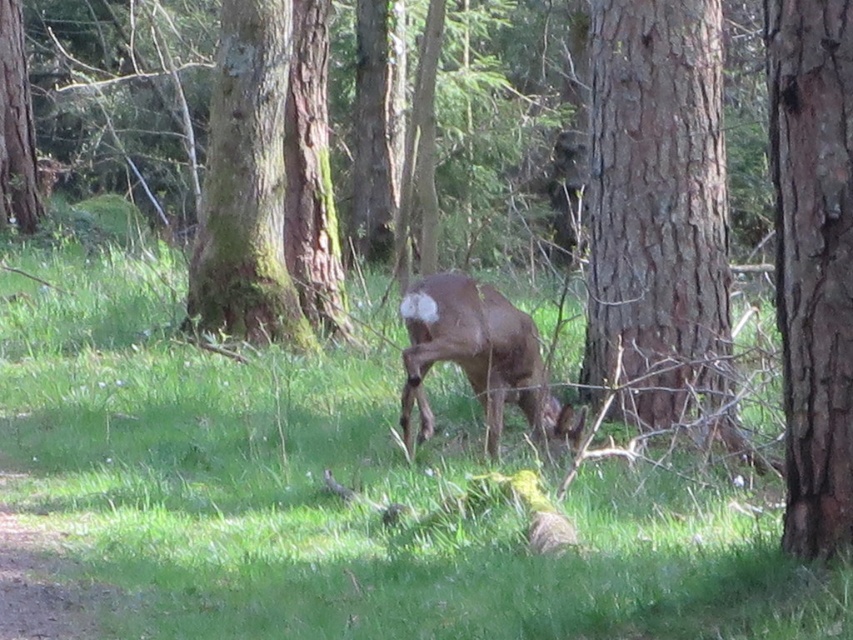
Who is more distant from viewer, (598, 332) or (819, 342)?

Positioned behind is point (598, 332).

Which is in front, point (627, 81) or point (799, 356)?

Point (799, 356) is more forward.

I want to click on smooth brown tree trunk at center, so click(657, 211).

In the scene shown: Measure the distance between point (651, 198) and camera.

32.21 feet

Between point (709, 19) and point (514, 307), which one is positioned in front?

Positioned in front is point (514, 307).

Between point (722, 220) and point (497, 429), which one is positioned behind?

The point (722, 220) is more distant.

You are a GUI agent. You are given a task and a screenshot of the screen. Output one action in this format:
    pyautogui.click(x=<x>, y=<y>)
    Task: Click on the smooth brown tree trunk at center
    
    Given the screenshot: What is the action you would take?
    pyautogui.click(x=657, y=211)

Is green grassy at center behind smooth brown tree trunk at right?

No, it is not.

Identify the location of green grassy at center. The width and height of the screenshot is (853, 640). (346, 486).

This screenshot has width=853, height=640. What are the coordinates of `green grassy at center` in the screenshot? It's located at (346, 486).